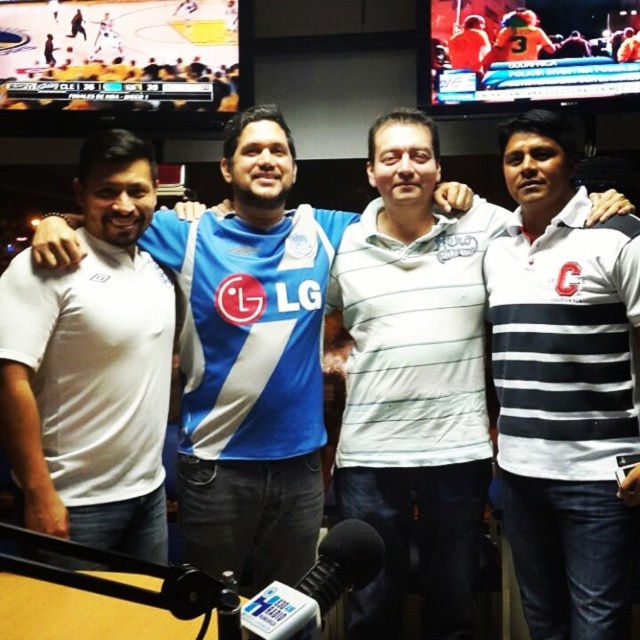
Question: Which point is farther to the camera?

Choices:
 (A) (339, 576)
 (B) (170, 288)

Answer: (B)

Question: Which point is closer to the camera?

Choices:
 (A) (81, 458)
 (B) (243, 500)

Answer: (A)

Question: Which of these objects is positioned closest to the black matte microphone at lower center?

Choices:
 (A) blue jersey at center
 (B) white matte t-shirt at left
 (C) white striped polo shirt at center

Answer: (B)

Question: Does white striped polo shirt at center have a greater width compared to black matte microphone at lower center?

Choices:
 (A) no
 (B) yes

Answer: (B)

Question: Does white striped polo shirt at center appear under blue jersey at center?

Choices:
 (A) no
 (B) yes

Answer: (B)

Question: Observing the image, what is the correct spatial positioning of white striped polo shirt at center in reference to white matte t-shirt at left?

Choices:
 (A) left
 (B) right

Answer: (B)